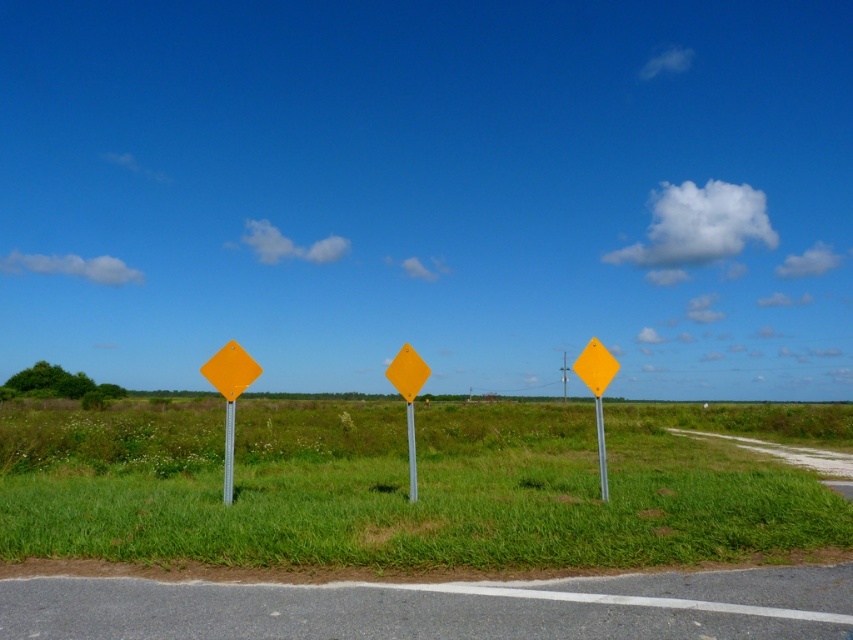
You are a gardener who needs to place a new 10 feet long decorative fence between the yellow diamond sign at center and the yellow plastic signpost at left. Can you fit it without moving either sign?

The distance between the yellow diamond sign at center and the yellow plastic signpost at left is 15.88 feet, so yes, the 10 feet long decorative fence can be placed between them as there is enough space.

You are a pedestrian standing on the road edge marked by the white line. You see the matte yellow diamond at left and the yellow plastic pole at center. Which object is nearer to you?

The matte yellow diamond at left is closer to the viewer than the yellow plastic pole at center.